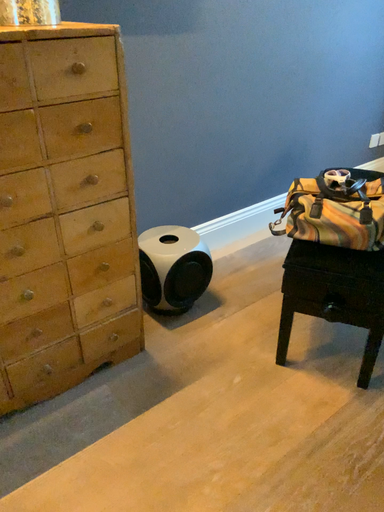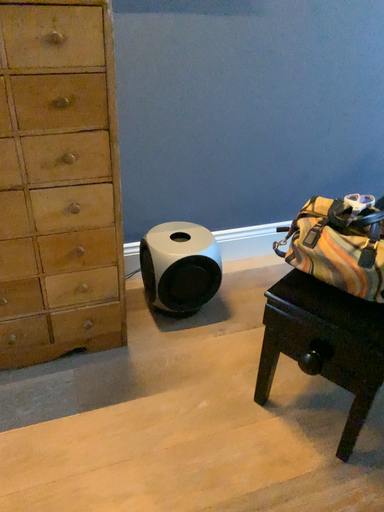
Question: Which way did the camera rotate in the video?

Choices:
 (A) rotated right
 (B) rotated left

Answer: (B)